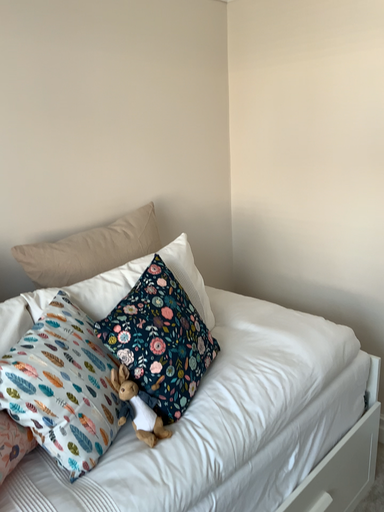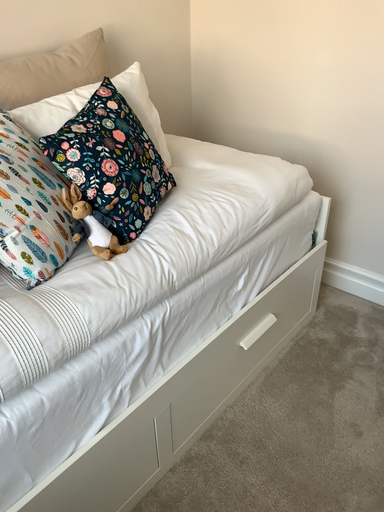
Question: Which way did the camera rotate in the video?

Choices:
 (A) rotated downward
 (B) rotated upward

Answer: (A)